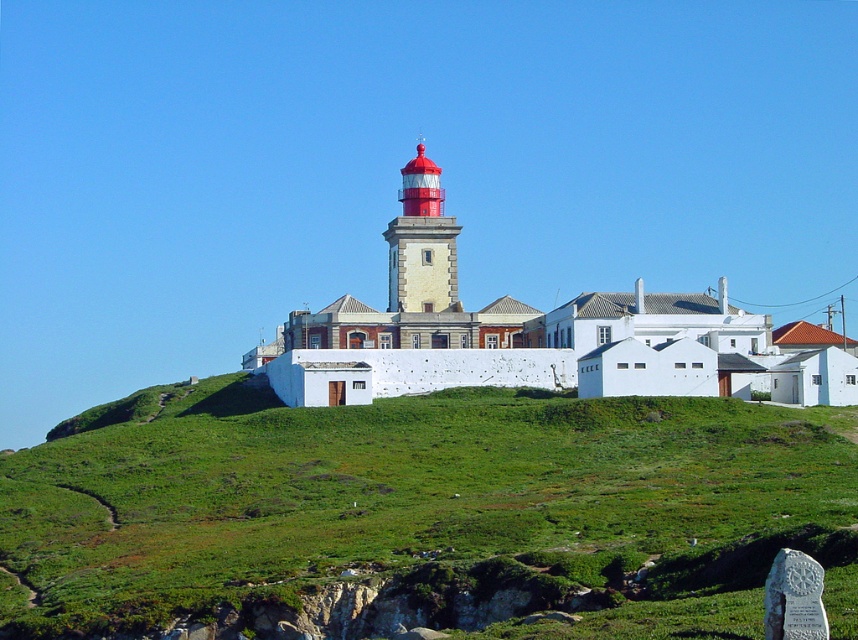
Which is in front, point (554, 508) or point (432, 179)?

Positioned in front is point (554, 508).

Who is higher up, green grassy hillside at center or smooth red lighthouse at center?

smooth red lighthouse at center is above.

Does point (768, 554) lie behind point (408, 186)?

That is False.

Image resolution: width=858 pixels, height=640 pixels. I want to click on green grassy hillside at center, so click(x=415, y=513).